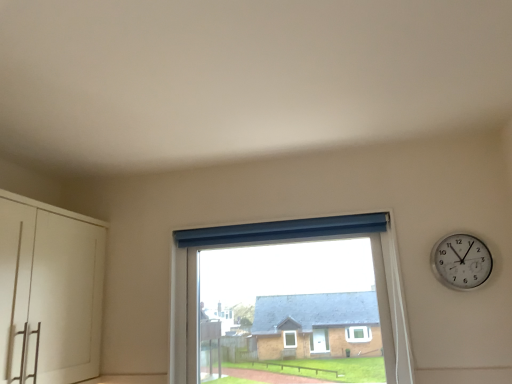
Question: Can silver metallic wall clock at upper right be found inside transparent glass window at center?

Choices:
 (A) no
 (B) yes

Answer: (A)

Question: From a real-world perspective, is transparent glass window at center beneath silver metallic wall clock at upper right?

Choices:
 (A) no
 (B) yes

Answer: (B)

Question: From a real-world perspective, does transparent glass window at center stand above silver metallic wall clock at upper right?

Choices:
 (A) yes
 (B) no

Answer: (B)

Question: Is transparent glass window at center located outside silver metallic wall clock at upper right?

Choices:
 (A) no
 (B) yes

Answer: (B)

Question: Does transparent glass window at center have a lesser height compared to silver metallic wall clock at upper right?

Choices:
 (A) no
 (B) yes

Answer: (A)

Question: Considering the relative sizes of transparent glass window at center and silver metallic wall clock at upper right in the image provided, is transparent glass window at center bigger than silver metallic wall clock at upper right?

Choices:
 (A) yes
 (B) no

Answer: (A)

Question: Considering the relative sizes of white matte cabinet at left and transparent glass window at center in the image provided, is white matte cabinet at left shorter than transparent glass window at center?

Choices:
 (A) yes
 (B) no

Answer: (B)

Question: From a real-world perspective, is white matte cabinet at left on transparent glass window at center?

Choices:
 (A) no
 (B) yes

Answer: (B)

Question: Is white matte cabinet at left facing away from transparent glass window at center?

Choices:
 (A) yes
 (B) no

Answer: (B)

Question: Does white matte cabinet at left have a larger size compared to transparent glass window at center?

Choices:
 (A) no
 (B) yes

Answer: (B)

Question: Does white matte cabinet at left contain transparent glass window at center?

Choices:
 (A) yes
 (B) no

Answer: (B)

Question: Can you confirm if white matte cabinet at left is positioned to the right of transparent glass window at center?

Choices:
 (A) yes
 (B) no

Answer: (B)

Question: Would you consider silver metallic wall clock at upper right to be distant from white matte cabinet at left?

Choices:
 (A) no
 (B) yes

Answer: (B)